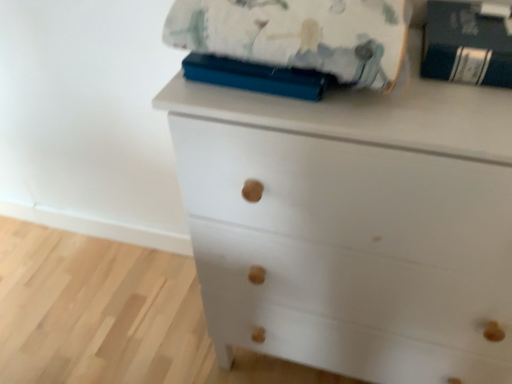
Question: Is the depth of fluffy cotton blanket at upper center less than that of white matte chest of drawers at center?

Choices:
 (A) yes
 (B) no

Answer: (B)

Question: Is fluffy cotton blanket at upper center positioned with its back to white matte chest of drawers at center?

Choices:
 (A) yes
 (B) no

Answer: (B)

Question: Can you confirm if fluffy cotton blanket at upper center is wider than white matte chest of drawers at center?

Choices:
 (A) no
 (B) yes

Answer: (A)

Question: From a real-world perspective, is fluffy cotton blanket at upper center on top of white matte chest of drawers at center?

Choices:
 (A) no
 (B) yes

Answer: (B)

Question: Is fluffy cotton blanket at upper center located outside white matte chest of drawers at center?

Choices:
 (A) no
 (B) yes

Answer: (B)

Question: In terms of height, does fluffy cotton blanket at upper center look taller or shorter compared to dark blue hardcover book at upper right?

Choices:
 (A) tall
 (B) short

Answer: (A)

Question: Based on their positions, is fluffy cotton blanket at upper center located to the left or right of dark blue hardcover book at upper right?

Choices:
 (A) right
 (B) left

Answer: (B)

Question: From a real-world perspective, relative to dark blue hardcover book at upper right, is fluffy cotton blanket at upper center vertically above or below?

Choices:
 (A) above
 (B) below

Answer: (A)

Question: Is fluffy cotton blanket at upper center inside or outside of dark blue hardcover book at upper right?

Choices:
 (A) inside
 (B) outside

Answer: (B)

Question: From a real-world perspective, relative to white matte chest of drawers at center, is dark blue hardcover book at upper right vertically above or below?

Choices:
 (A) below
 (B) above

Answer: (B)

Question: In the image, is dark blue hardcover book at upper right positioned in front of or behind white matte chest of drawers at center?

Choices:
 (A) front
 (B) behind

Answer: (B)

Question: In terms of width, does dark blue hardcover book at upper right look wider or thinner when compared to white matte chest of drawers at center?

Choices:
 (A) wide
 (B) thin

Answer: (B)

Question: From the image's perspective, is dark blue hardcover book at upper right positioned above or below white matte chest of drawers at center?

Choices:
 (A) above
 (B) below

Answer: (A)

Question: Is dark blue hardcover book at upper right in front of or behind fluffy cotton blanket at upper center in the image?

Choices:
 (A) front
 (B) behind

Answer: (B)

Question: Looking at the image, does dark blue hardcover book at upper right seem bigger or smaller compared to fluffy cotton blanket at upper center?

Choices:
 (A) small
 (B) big

Answer: (A)